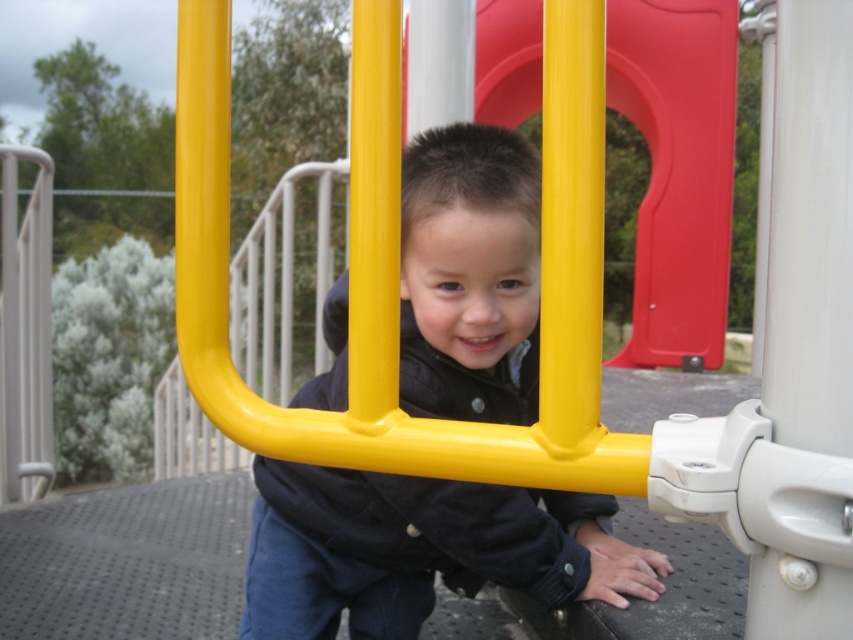
You are a parent trying to ensure your child stays safe while playing. The child is near the smooth plastic slide at center and the yellow matte pole at center. Which object is above the other?

The smooth plastic slide at center is positioned over the yellow matte pole at center, meaning the slide is above the pole.

You are a photographer trying to capture the child in the playground. You notice two points marked in the image. The first point is at coordinate point (520, 358) and the second is at point (728, 220). Which point is closer to you, the photographer, when you are positioned at the camera location?

Point (520, 358) is closer to the viewer than point (728, 220), so the first point is closer to you, the photographer, when positioned at the camera location.